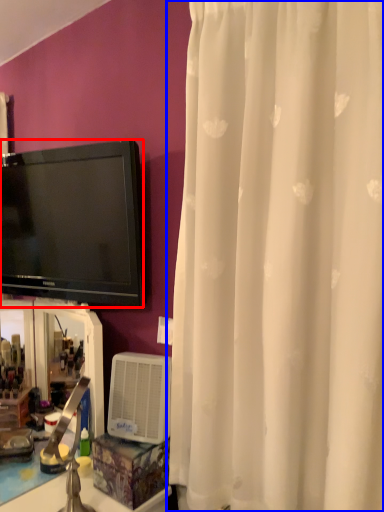
Question: Which of the following is the closest to the observer, television (highlighted by a red box) or curtain (highlighted by a blue box)?

Choices:
 (A) television
 (B) curtain

Answer: (B)